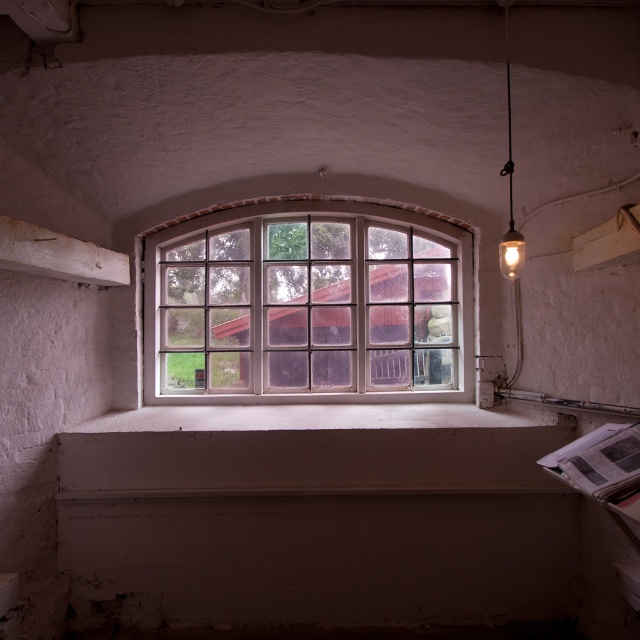
Does point (67, 272) come closer to viewer compared to point (499, 244)?

No, (67, 272) is further to viewer.

Does white wooden beam at left have a larger size compared to matte glass bulb at upper right?

Incorrect, white wooden beam at left is not larger than matte glass bulb at upper right.

Between point (6, 221) and point (515, 256), which one is positioned in front?

Point (6, 221)

Image resolution: width=640 pixels, height=640 pixels. What are the coordinates of `white wooden beam at left` in the screenshot? It's located at (58, 253).

Is white wooden window frame at center above white wooden beam at left?

Incorrect, white wooden window frame at center is not positioned above white wooden beam at left.

Who is lower down, white wooden window frame at center or white wooden beam at left?

white wooden window frame at center is below.

Is point (465, 385) closer to camera compared to point (44, 262)?

No, it is behind (44, 262).

I want to click on white wooden window frame at center, so click(x=307, y=305).

Between point (552, 483) and point (17, 244), which one is positioned in front?

Point (17, 244) is more forward.

Is white concrete window sill at center bigger than white wooden beam at left?

Indeed, white concrete window sill at center has a larger size compared to white wooden beam at left.

Does point (488, 452) come in front of point (48, 228)?

That is False.

You are a GUI agent. You are given a task and a screenshot of the screen. Output one action in this format:
    pyautogui.click(x=<x>, y=<y>)
    Task: Click on the white concrete window sill at center
    Image resolution: width=640 pixels, height=640 pixels.
    Given the screenshot: What is the action you would take?
    pyautogui.click(x=308, y=449)